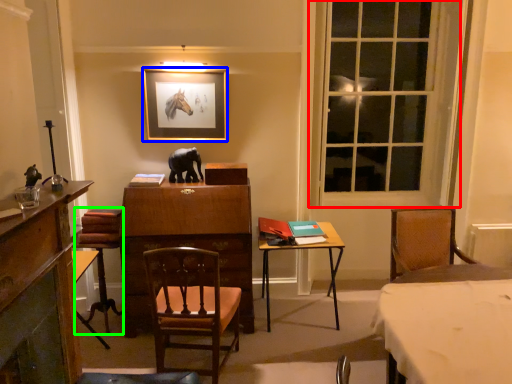
Question: Which object is the farthest from window (highlighted by a red box)? Choose among these: picture frame (highlighted by a blue box) or swivel chair (highlighted by a green box).

Choices:
 (A) picture frame
 (B) swivel chair

Answer: (B)